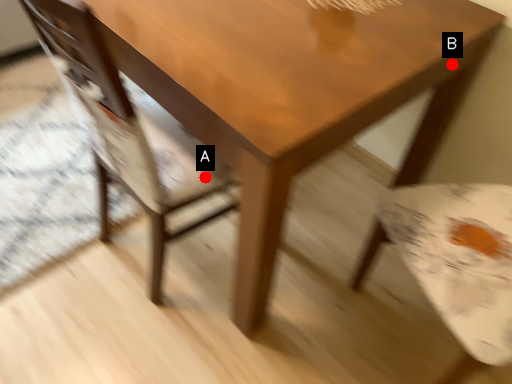
Question: Two points are circled on the image, labeled by A and B beside each circle. Which point is further to the camera?

Choices:
 (A) A is further
 (B) B is further

Answer: (A)